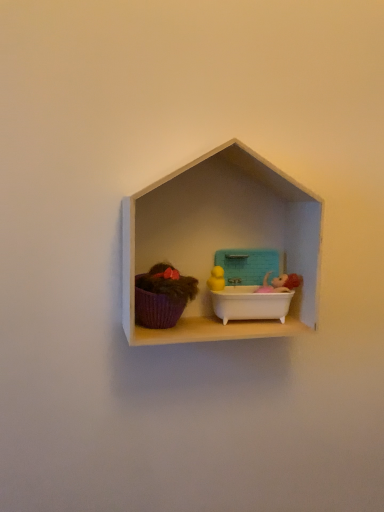
Question: Is purple fabric basket at left not inside white matte shelf at center?

Choices:
 (A) yes
 (B) no

Answer: (B)

Question: Is purple fabric basket at left oriented towards white matte shelf at center?

Choices:
 (A) no
 (B) yes

Answer: (B)

Question: From the image's perspective, is purple fabric basket at left above white matte shelf at center?

Choices:
 (A) yes
 (B) no

Answer: (B)

Question: From the image's perspective, is purple fabric basket at left beneath white matte shelf at center?

Choices:
 (A) no
 (B) yes

Answer: (B)

Question: Is purple fabric basket at left at the left side of white matte shelf at center?

Choices:
 (A) no
 (B) yes

Answer: (B)

Question: Considering the relative sizes of purple fabric basket at left and white matte shelf at center in the image provided, is purple fabric basket at left shorter than white matte shelf at center?

Choices:
 (A) yes
 (B) no

Answer: (A)

Question: From the image's perspective, would you say white matte shelf at center is positioned over purple fabric basket at left?

Choices:
 (A) no
 (B) yes

Answer: (B)

Question: Is white matte shelf at center behind purple fabric basket at left?

Choices:
 (A) no
 (B) yes

Answer: (A)

Question: Can you confirm if white matte shelf at center is shorter than purple fabric basket at left?

Choices:
 (A) no
 (B) yes

Answer: (A)

Question: Does white matte shelf at center turn towards purple fabric basket at left?

Choices:
 (A) no
 (B) yes

Answer: (B)

Question: Does white matte shelf at center appear on the left side of purple fabric basket at left?

Choices:
 (A) no
 (B) yes

Answer: (A)

Question: Considering the relative sizes of white matte shelf at center and purple fabric basket at left in the image provided, is white matte shelf at center taller than purple fabric basket at left?

Choices:
 (A) yes
 (B) no

Answer: (A)

Question: From a real-world perspective, is teal plastic lunch box at center on white matte shelf at center?

Choices:
 (A) no
 (B) yes

Answer: (A)